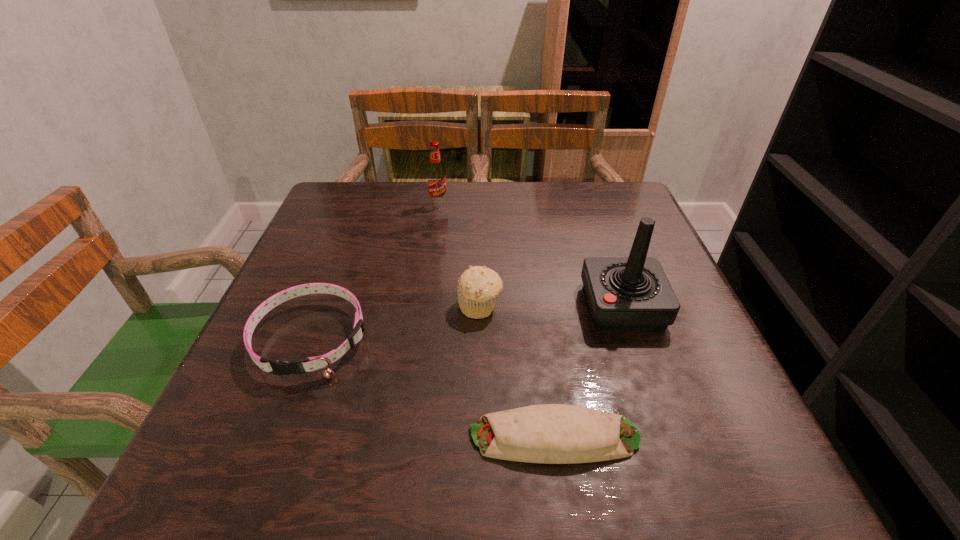
Image resolution: width=960 pixels, height=540 pixels. In order to click on vacant space that is in between the farthest object and the second shortest object in this screenshot , I will do `click(375, 271)`.

Identify the location of unoccupied area between the muffin and the second tallest object. The height and width of the screenshot is (540, 960). (459, 255).

What are the coordinates of `free space between the shortest object and the joystick` in the screenshot? It's located at (588, 372).

Identify the location of vacant area that lies between the second object from left to right and the second shortest object. This screenshot has height=540, width=960. (375, 271).

At what (x,y) coordinates should I click in order to perform the action: click on free space between the farthest object and the muffin. Please return your answer as a coordinate pair (x, y). Looking at the image, I should click on (459, 255).

Identify the location of free point between the muffin and the nearest object. [x=517, y=372].

Locate an element on the screen. Image resolution: width=960 pixels, height=540 pixels. vacant area that lies between the third shortest object and the joystick is located at coordinates pos(551,306).

Select which object is the third closest to the third tallest object. Please provide its 2D coordinates. Your answer should be formatted as a tuple, i.e. [(x, y)], where the tuple contains the x and y coordinates of a point satisfying the conditions above.

[(548, 433)]

Where is `object that is the third closest to the nearest object`? The height and width of the screenshot is (540, 960). object that is the third closest to the nearest object is located at coordinates (278, 367).